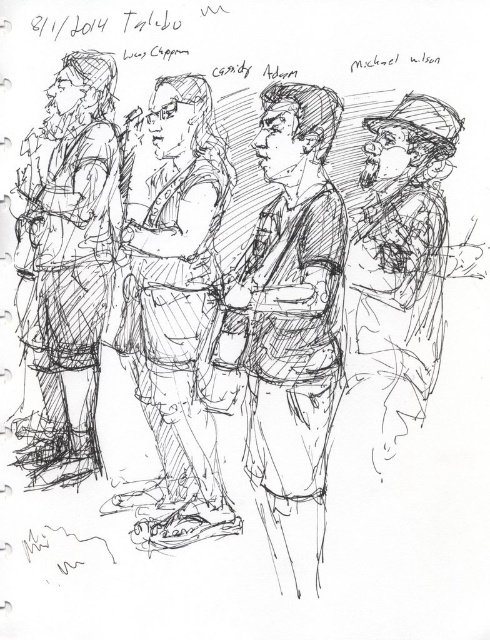
Question: Estimate the real-world distances between objects in this image. Which object is farther from the smooth skin tone figure at center?

Choices:
 (A) matte black jacket at left
 (B) smooth brown vest at center

Answer: (A)

Question: Where is smooth skin tone figure at center located in relation to matte black jacket at left in the image?

Choices:
 (A) below
 (B) above

Answer: (A)

Question: Which point appears farthest from the camera in this image?

Choices:
 (A) (391, 216)
 (B) (254, 342)
 (C) (73, 72)
 (D) (165, 403)

Answer: (C)

Question: Which object appears farthest from the camera in this image?

Choices:
 (A) matte black jacket at left
 (B) smooth skin tone figure at center
 (C) smooth brown vest at center
 (D) shiny metallic hat at right

Answer: (A)

Question: Where is smooth brown vest at center located in relation to smooth skin tone figure at center in the image?

Choices:
 (A) right
 (B) left

Answer: (B)

Question: Is smooth brown vest at center further to the viewer compared to shiny metallic hat at right?

Choices:
 (A) no
 (B) yes

Answer: (B)